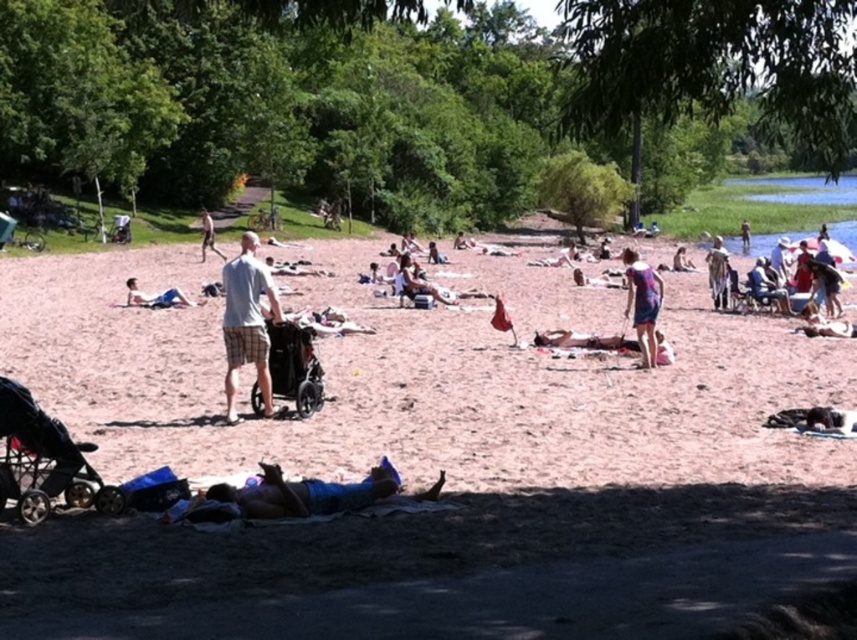
Which of these two, pink sand at center or blue fabric at lower center, stands shorter?

blue fabric at lower center is shorter.

Can you confirm if pink sand at center is bigger than blue fabric at lower center?

Yes, pink sand at center is bigger than blue fabric at lower center.

Which is in front, point (454, 464) or point (304, 477)?

Point (304, 477)

You are a GUI agent. You are given a task and a screenshot of the screen. Output one action in this format:
    pyautogui.click(x=<x>, y=<y>)
    Task: Click on the pink sand at center
    The height and width of the screenshot is (640, 857).
    Given the screenshot: What is the action you would take?
    pyautogui.click(x=418, y=385)

Does point (811, 182) lie in front of point (652, 328)?

That is False.

Can you confirm if blue water at upper right is positioned above multicolored fabric dress at center-right?

Yes, blue water at upper right is above multicolored fabric dress at center-right.

You are a GUI agent. You are given a task and a screenshot of the screen. Output one action in this format:
    pyautogui.click(x=<x>, y=<y>)
    Task: Click on the blue water at upper right
    This screenshot has width=857, height=640.
    Given the screenshot: What is the action you would take?
    pyautogui.click(x=802, y=189)

Can you confirm if gray plaid shorts at center is smaller than dark gray plastic stroller at center?

No, gray plaid shorts at center is not smaller than dark gray plastic stroller at center.

Which of these two, gray plaid shorts at center or dark gray plastic stroller at center, stands shorter?

Standing shorter between the two is dark gray plastic stroller at center.

The image size is (857, 640). I want to click on gray plaid shorts at center, so click(x=247, y=323).